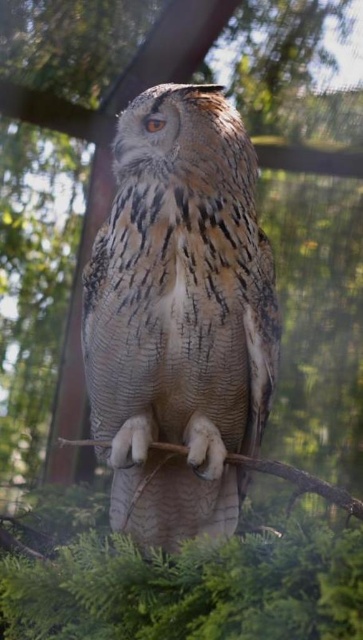
Does point (177, 496) come closer to viewer compared to point (253, 464)?

No, it is not.

The height and width of the screenshot is (640, 363). I want to click on speckled feathered owl at center, so tap(180, 316).

The width and height of the screenshot is (363, 640). In order to click on speckled feathered owl at center in this screenshot , I will do `click(180, 316)`.